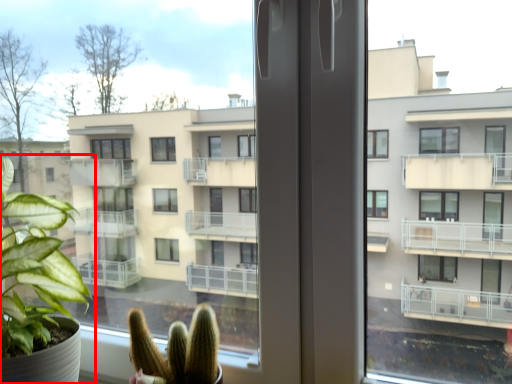
Question: From the image's perspective, what is the correct spatial positioning of houseplant (annotated by the red box) in reference to houseplant?

Choices:
 (A) above
 (B) below

Answer: (A)